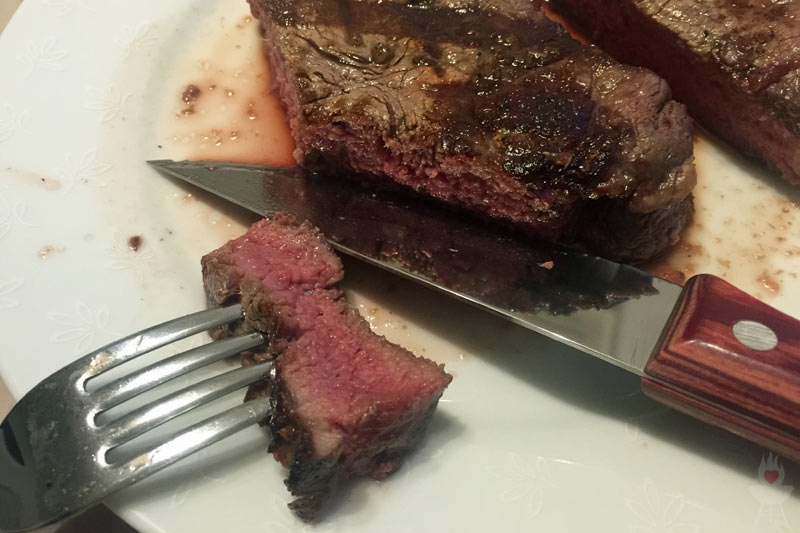
I want to click on plate, so click(x=518, y=474).